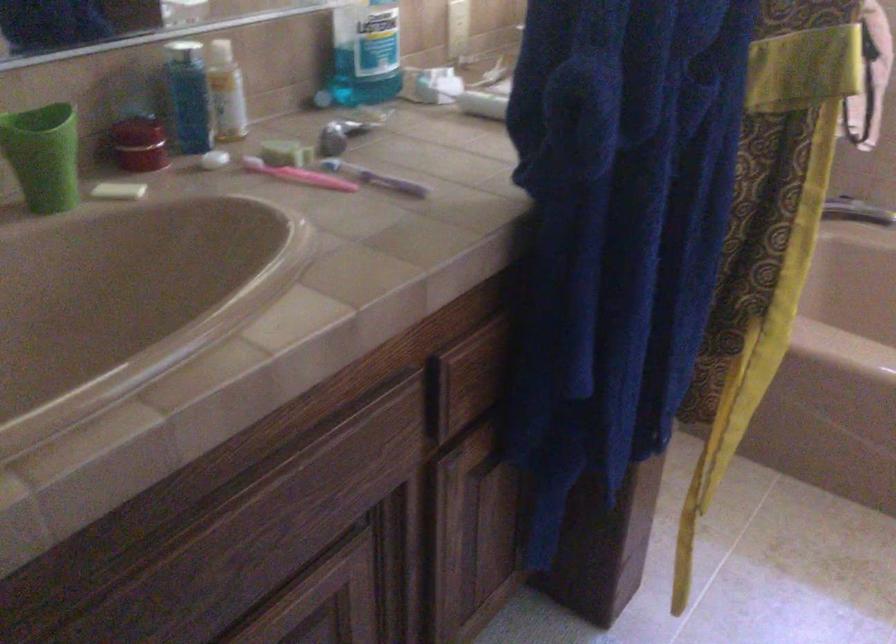
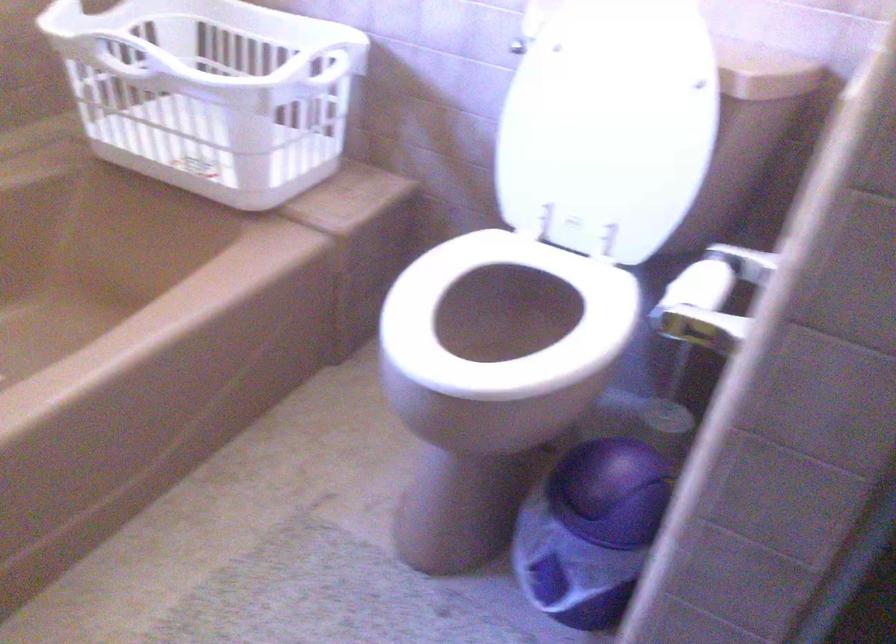
The first image is from the beginning of the video and the second image is from the end. How did the camera likely rotate when shooting the video?

The camera's rotation is toward right-down.